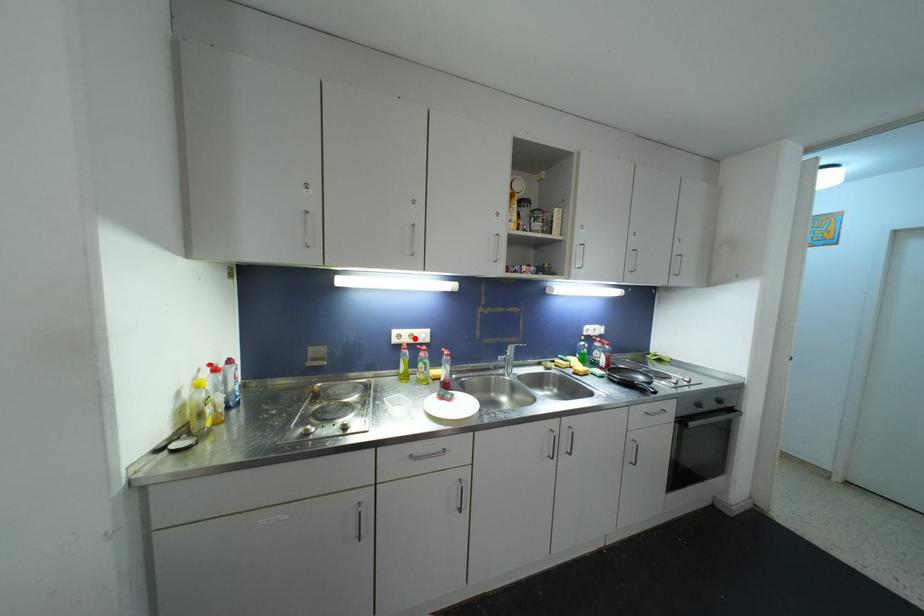
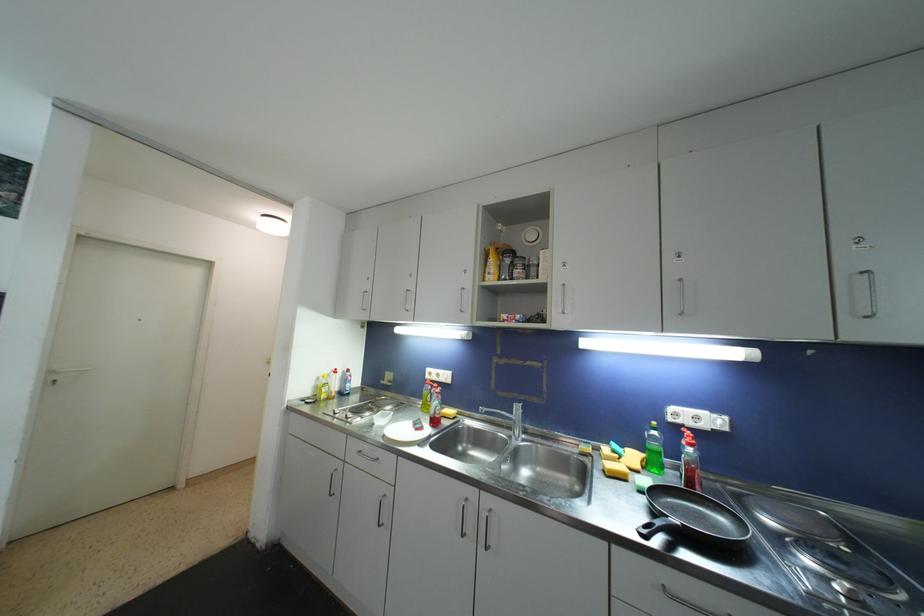
The point at the highlighted location is marked in the first image. Where is the corresponding point in the second image?

(441, 378)